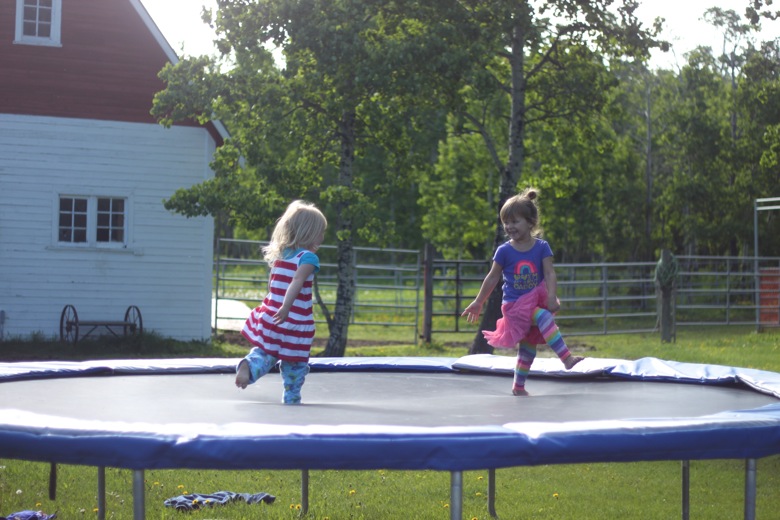
Find the location of a particular element. attic window, top left corner is located at coordinates (37, 29).